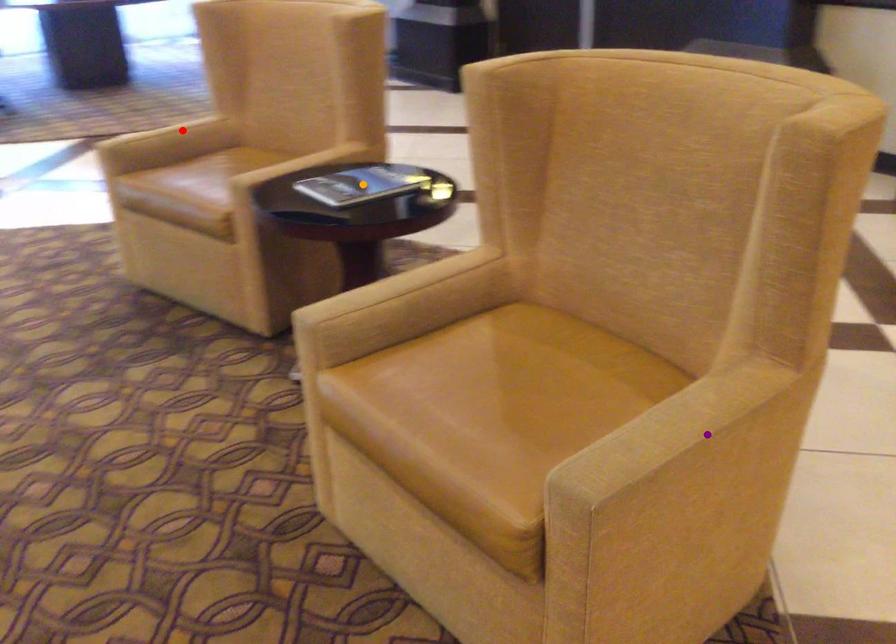
Order these from farthest to nearest:
A) orange point
B) purple point
C) red point

red point < orange point < purple point